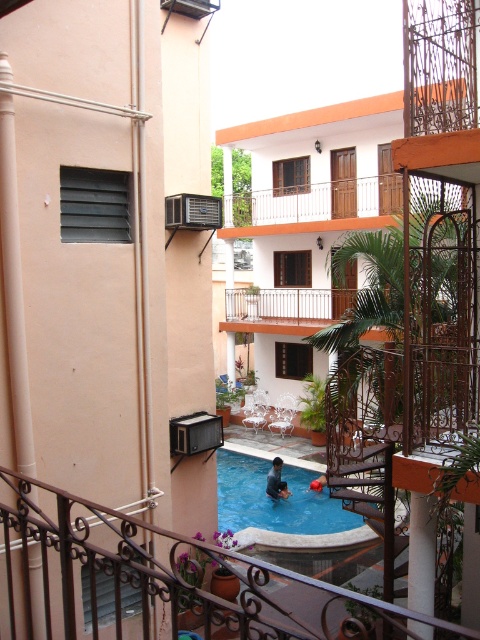
Is point (74, 24) behind point (15, 577)?

Yes, it is.

Could you measure the distance between matte black air conditioner at left and black wrought iron railing at lower center?

matte black air conditioner at left and black wrought iron railing at lower center are 8.69 feet apart from each other.

Identify the location of matte black air conditioner at left. Image resolution: width=480 pixels, height=640 pixels. (107, 250).

Is white wood balcony at upper center further to camera compared to white marble pillar at lower right?

Yes, it is behind white marble pillar at lower right.

Is white wood balcony at upper center below white marble pillar at lower right?

Actually, white wood balcony at upper center is above white marble pillar at lower right.

What do you see at coordinates (308, 208) in the screenshot?
I see `white wood balcony at upper center` at bounding box center [308, 208].

The image size is (480, 640). Identify the location of white wood balcony at upper center. (x=308, y=208).

Is matte black air conditioner at left taller than white wooden balcony at upper center?

No, matte black air conditioner at left is not taller than white wooden balcony at upper center.

Where is `matte black air conditioner at left`? The image size is (480, 640). matte black air conditioner at left is located at coordinates (107, 250).